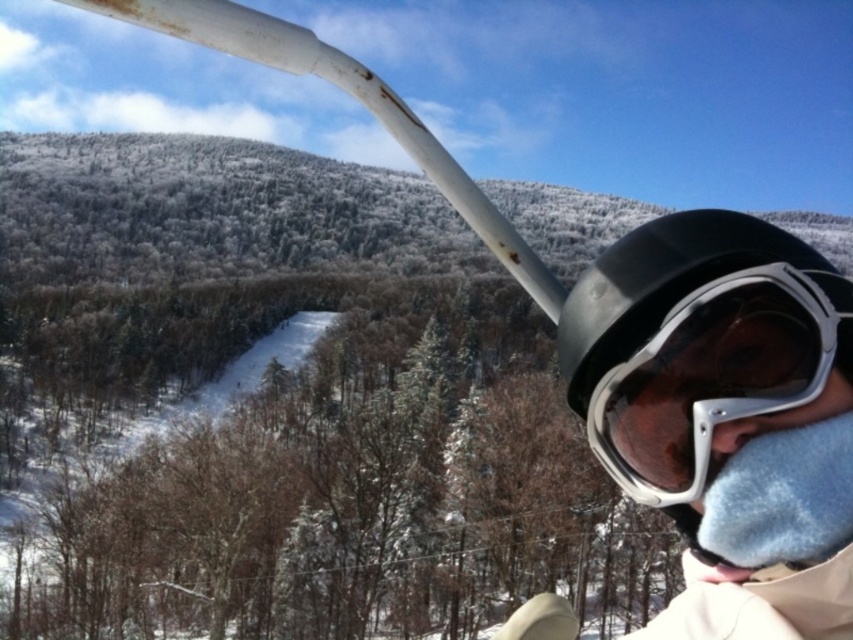
You are a photographer trying to capture the position of the matte black goggles at right in the image. According to the coordinates provided, where would you focus your camera to ensure the goggles are centered in the frame?

The matte black goggles at right are located at the 2D coordinates point [717,374], so focusing the camera there would center them in the frame.

You are a photographer trying to capture a closeup of the matte black goggles at right and the matte white nose at lower center in the winter ski lift scene. Given the distance between them, will you need to adjust your camera focus to ensure both are in sharp focus?

The distance between the matte black goggles at right and the matte white nose at lower center is 24.36 inches. To ensure both are in sharp focus, you may need to adjust your camera focus, as the depth of field might not naturally cover this distance without adjustment.